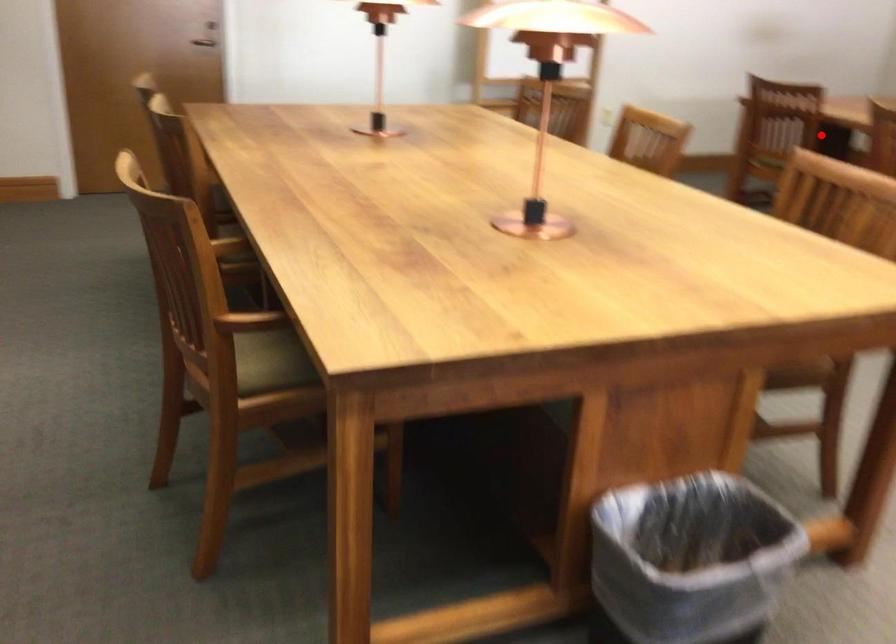
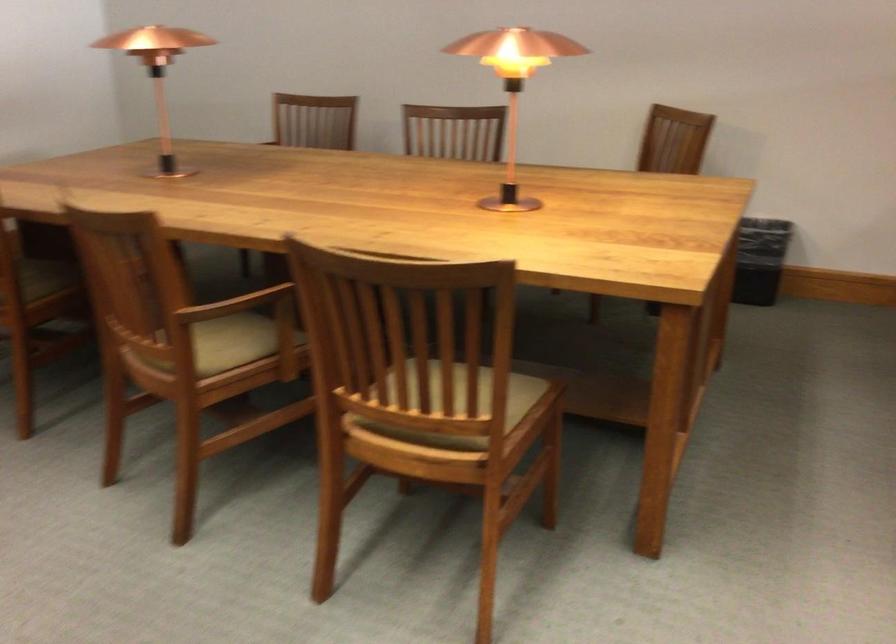
Question: I am providing you with two images of the same scene from different viewpoints. Given a red point in image1, look at the same physical point in image2. Is it:

Choices:
 (A) Closer to the viewpoint
 (B) Farther from the viewpoint

Answer: (A)